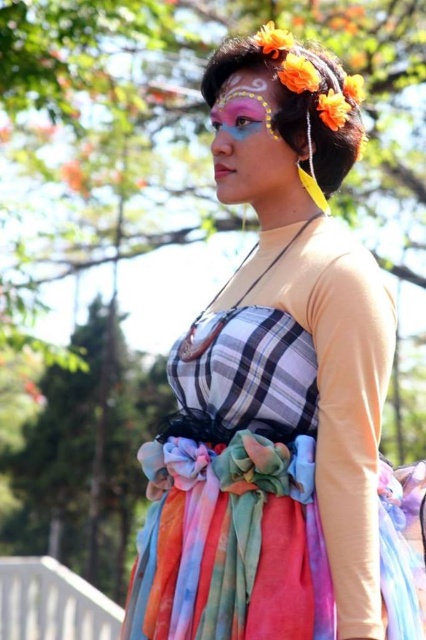
Who is higher up, multicolored fabric dress at center or matte colorful face at center?

matte colorful face at center is above.

Does multicolored fabric dress at center have a greater width compared to matte colorful face at center?

Yes, multicolored fabric dress at center is wider than matte colorful face at center.

Where is `multicolored fabric dress at center`? multicolored fabric dress at center is located at coordinates (279, 392).

Where is `multicolored fabric dress at center`? Image resolution: width=426 pixels, height=640 pixels. multicolored fabric dress at center is located at coordinates (279, 392).